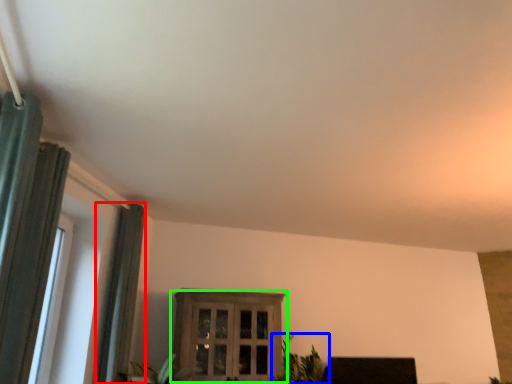
Question: Which object is positioned closest to curtain (highlighted by a red box)? Select from houseplant (highlighted by a blue box) and window (highlighted by a green box).

Choices:
 (A) houseplant
 (B) window

Answer: (B)